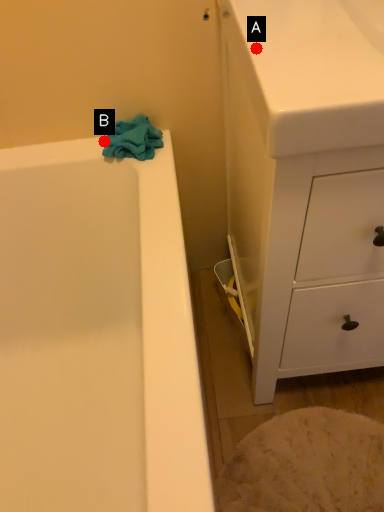
Question: Two points are circled on the image, labeled by A and B beside each circle. Which point is closer to the camera?

Choices:
 (A) A is closer
 (B) B is closer

Answer: (A)